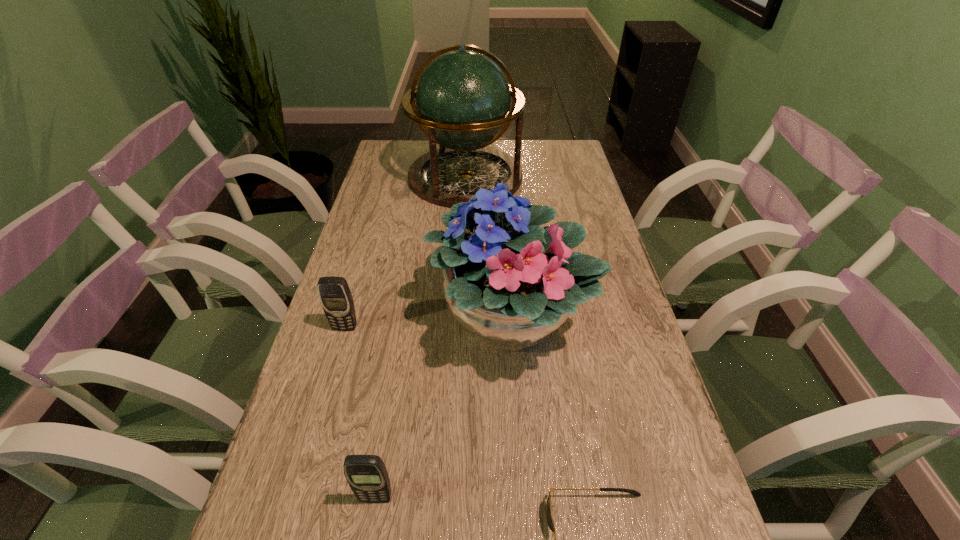
This screenshot has width=960, height=540. I want to click on globe that is at the left edge, so click(x=463, y=99).

The image size is (960, 540). What are the coordinates of `object that is positioned at the right edge` in the screenshot? It's located at (510, 284).

Where is `object that is at the far left corner`? object that is at the far left corner is located at coordinates (463, 99).

I want to click on free space at the left edge of the desktop, so click(385, 179).

You are a GUI agent. You are given a task and a screenshot of the screen. Output one action in this format:
    pyautogui.click(x=<x>, y=<y>)
    Task: Click on the free space at the right edge of the desktop
    This screenshot has width=960, height=540.
    Given the screenshot: What is the action you would take?
    pyautogui.click(x=587, y=202)

The height and width of the screenshot is (540, 960). I want to click on blank space at the far left corner of the desktop, so click(416, 153).

Find the location of a particular element. This screenshot has height=540, width=960. empty space that is in between the right cellular telephone and the tallest object is located at coordinates (420, 338).

You are a GUI agent. You are given a task and a screenshot of the screen. Output one action in this format:
    pyautogui.click(x=<x>, y=<y>)
    Task: Click on the empty space that is in between the nearer cellular telephone and the left cellular telephone
    The height and width of the screenshot is (540, 960).
    Given the screenshot: What is the action you would take?
    361,413

Where is `free space between the globe and the farther cellular telephone`? free space between the globe and the farther cellular telephone is located at coordinates (405, 252).

Locate an element on the screen. The height and width of the screenshot is (540, 960). free space between the fourth shortest object and the nearer cellular telephone is located at coordinates (443, 409).